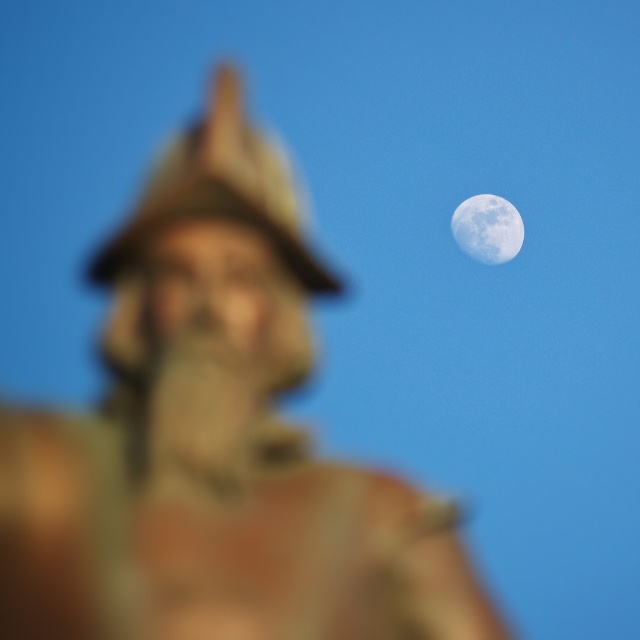
Locate an element on the screen. The width and height of the screenshot is (640, 640). matte stone statue at upper right is located at coordinates (214, 442).

Consider the image. Between matte stone statue at upper right and smooth white moon at upper right, which one is positioned higher?

smooth white moon at upper right is higher up.

The image size is (640, 640). In order to click on matte stone statue at upper right in this screenshot , I will do `click(214, 442)`.